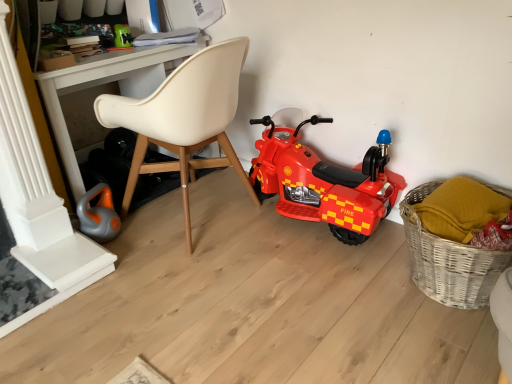
Where is `free region on the left part of woven wicker basket at lower right`? Image resolution: width=512 pixels, height=384 pixels. free region on the left part of woven wicker basket at lower right is located at coordinates (350, 294).